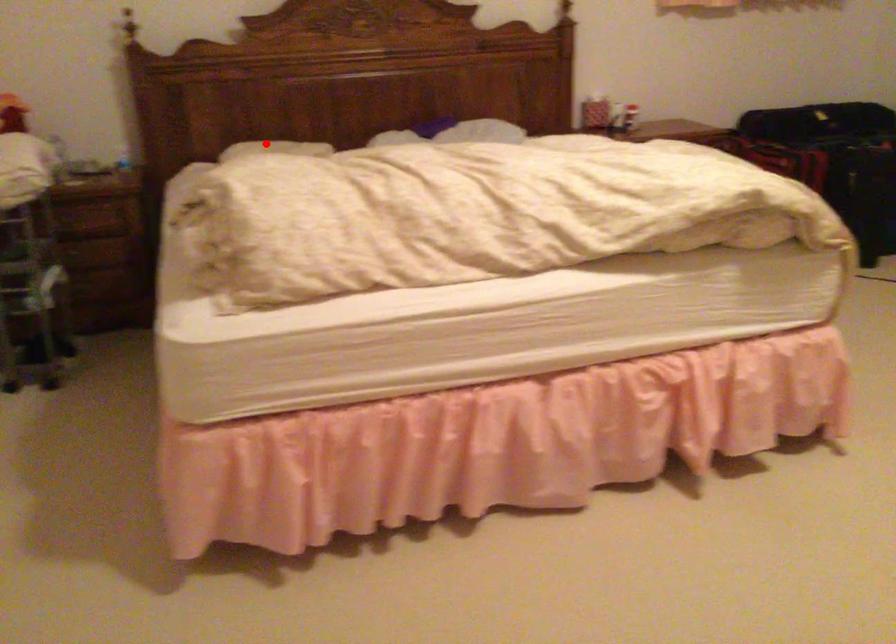
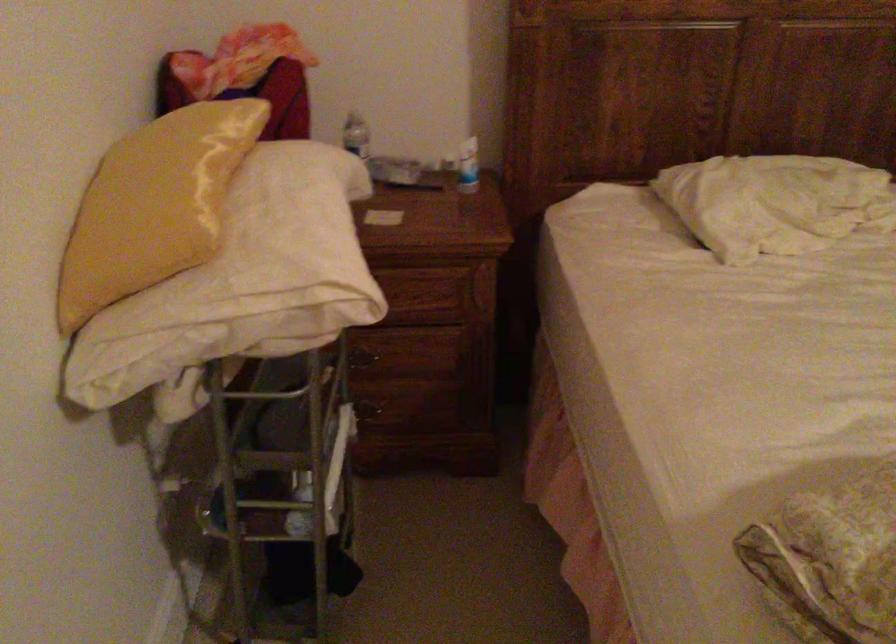
Locate, in the second image, the point that corresponds to the highlighted location in the first image.

(774, 202)